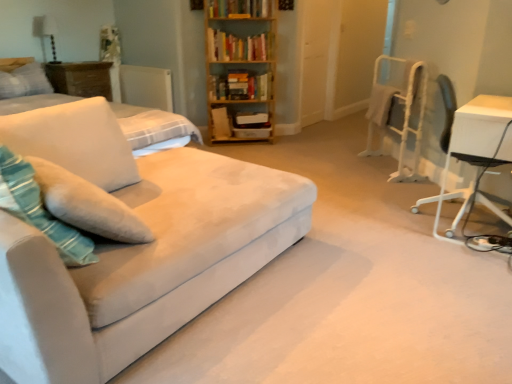
Question: Considering the relative positions of suede couch at left and soft white fabric pillow at left, the 2th pillow viewed from the top, in the image provided, is suede couch at left to the right of soft white fabric pillow at left, the 2th pillow viewed from the top, from the viewer's perspective?

Choices:
 (A) no
 (B) yes

Answer: (B)

Question: Is suede couch at left closer to the viewer compared to soft white fabric pillow at left, marked as the first pillow in a bottom-to-top arrangement?

Choices:
 (A) no
 (B) yes

Answer: (B)

Question: From a real-world perspective, is suede couch at left positioned under soft white fabric pillow at left, the 2th pillow viewed from the top, based on gravity?

Choices:
 (A) yes
 (B) no

Answer: (A)

Question: Considering the relative sizes of suede couch at left and soft white fabric pillow at left, marked as the first pillow in a bottom-to-top arrangement, in the image provided, is suede couch at left smaller than soft white fabric pillow at left, marked as the first pillow in a bottom-to-top arrangement,?

Choices:
 (A) yes
 (B) no

Answer: (B)

Question: Considering the relative sizes of suede couch at left and soft white fabric pillow at left, acting as the second pillow starting from the left, in the image provided, is suede couch at left shorter than soft white fabric pillow at left, acting as the second pillow starting from the left,?

Choices:
 (A) yes
 (B) no

Answer: (B)

Question: Could soft white fabric pillow at left, the 1th pillow in the right-to-left sequence, be considered to be inside suede couch at left?

Choices:
 (A) yes
 (B) no

Answer: (A)

Question: Does soft white fabric pillow at left, the 1th pillow in the right-to-left sequence, turn towards white plastic chair at right?

Choices:
 (A) yes
 (B) no

Answer: (B)

Question: Is white plastic chair at right inside soft white fabric pillow at left, acting as the second pillow starting from the left?

Choices:
 (A) yes
 (B) no

Answer: (B)

Question: Is the depth of soft white fabric pillow at left, the 1th pillow in the right-to-left sequence, greater than that of white plastic chair at right?

Choices:
 (A) no
 (B) yes

Answer: (A)

Question: Can we say soft white fabric pillow at left, the 1th pillow in the right-to-left sequence, lies outside white plastic chair at right?

Choices:
 (A) no
 (B) yes

Answer: (B)

Question: From the image's perspective, would you say soft white fabric pillow at left, the 1th pillow in the right-to-left sequence, is positioned over white plastic chair at right?

Choices:
 (A) no
 (B) yes

Answer: (A)

Question: Would you say teal velvety throw pillow at left is outside white soft pillow at upper left, positioned as the second pillow in bottom-to-top order?

Choices:
 (A) no
 (B) yes

Answer: (B)